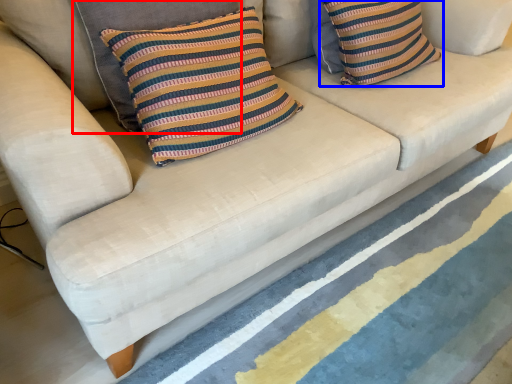
Question: Which of the following is the farthest to the observer, pillow (highlighted by a red box) or pillow (highlighted by a blue box)?

Choices:
 (A) pillow
 (B) pillow

Answer: (B)